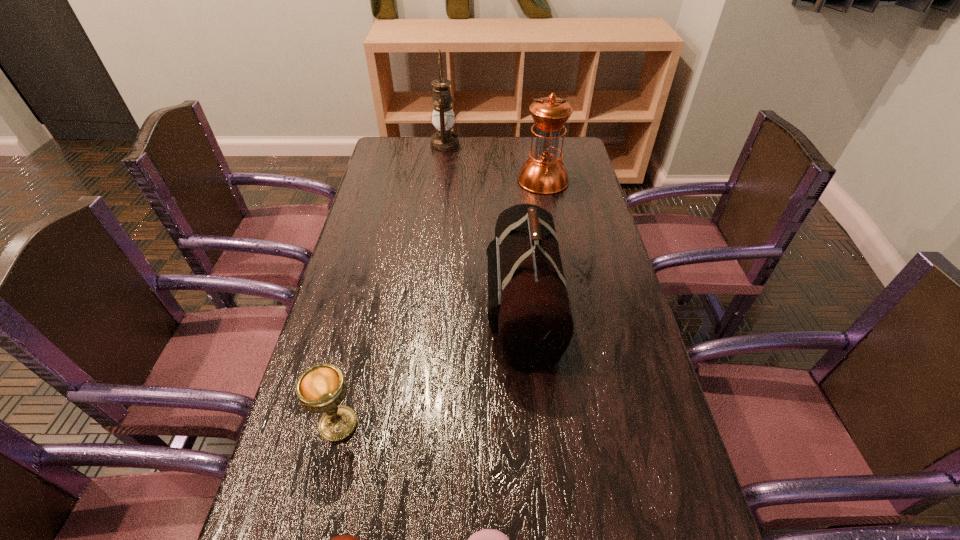
At what (x,y) coordinates should I click in order to perform the action: click on free space located 0.400m on the front pocket of the duffel bag. Please return your answer as a coordinate pair (x, y). The image size is (960, 540). Looking at the image, I should click on (338, 307).

Locate an element on the screen. vacant space situated on the front pocket of the duffel bag is located at coordinates (360, 307).

Locate an element on the screen. The width and height of the screenshot is (960, 540). vacant space located on the right of the fourth farthest object is located at coordinates (489, 424).

The height and width of the screenshot is (540, 960). Find the location of `object present at the left edge`. object present at the left edge is located at coordinates (321, 388).

Identify the location of object that is positioned at the right edge. The width and height of the screenshot is (960, 540). (544, 173).

Where is `object located in the far right corner section of the desktop`? This screenshot has height=540, width=960. object located in the far right corner section of the desktop is located at coordinates (544, 173).

What are the coordinates of `free space at the far edge of the desktop` in the screenshot? It's located at (491, 165).

You are a GUI agent. You are given a task and a screenshot of the screen. Output one action in this format:
    pyautogui.click(x=<x>, y=<y>)
    Task: Click on the vacant space at the left edge
    This screenshot has height=540, width=960.
    Given the screenshot: What is the action you would take?
    pyautogui.click(x=337, y=338)

Image resolution: width=960 pixels, height=540 pixels. In the image, there is a desktop. In order to click on vacant area at the right edge in this screenshot , I will do `click(656, 387)`.

In the image, there is a desktop. In order to click on vacant space at the far left corner in this screenshot , I will do (x=390, y=152).